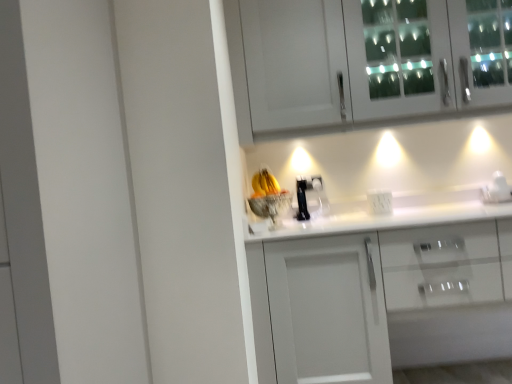
What do you see at coordinates (381, 294) in the screenshot? I see `white glossy cabinet at center, the second cabinetry viewed from the top` at bounding box center [381, 294].

Identify the location of white glossy cabinet at center, the second cabinetry viewed from the top. click(381, 294).

Is white plastic electric outlet at center positioned beyond the bounds of white glossy cabinet at center, the second cabinetry viewed from the top?

Actually, white plastic electric outlet at center is at least partially inside white glossy cabinet at center, the second cabinetry viewed from the top.

This screenshot has width=512, height=384. What are the coordinates of `electric outlet above the white glossy cabinet at center, the second cabinetry viewed from the top (from the image's perspective)` in the screenshot? It's located at (380, 201).

From the image's perspective, which one is positioned higher, white plastic electric outlet at center or white glossy cabinet at center, which is counted as the first cabinetry, starting from the bottom?

white plastic electric outlet at center, from the image's perspective.

Is there a large distance between white glossy coffee maker at right and white glossy cabinet at center, the second cabinetry viewed from the top?

No.

Considering the sizes of white glossy coffee maker at right and white glossy cabinet at center, which is counted as the first cabinetry, starting from the bottom, in the image, is white glossy coffee maker at right wider or thinner than white glossy cabinet at center, which is counted as the first cabinetry, starting from the bottom,?

In the image, white glossy coffee maker at right appears to be more narrow than white glossy cabinet at center, which is counted as the first cabinetry, starting from the bottom.

Starting from the white glossy coffee maker at right, which cabinetry is the 2nd one in front? Please provide its 2D coordinates.

[(381, 294)]

Measure the distance between white glossy coffee maker at right and white plastic electric outlet at center.

A distance of 20.58 inches exists between white glossy coffee maker at right and white plastic electric outlet at center.

In the scene shown: From the image's perspective, between white glossy coffee maker at right and white plastic electric outlet at center, who is located below?

white plastic electric outlet at center, from the image's perspective.

Which object is more forward, white glossy coffee maker at right or white plastic electric outlet at center?

Positioned in front is white glossy coffee maker at right.

The height and width of the screenshot is (384, 512). I want to click on appliance in front of the white plastic electric outlet at center, so click(x=496, y=189).

Locate an element on the screen. This screenshot has height=384, width=512. the 2nd cabinetry to the left of the white glossy coffee maker at right, counting from the anchor's position is located at coordinates (343, 73).

Which is in front, point (502, 185) or point (269, 122)?

The point (269, 122) is in front.

Does white glossy coffee maker at right have a greater height compared to white glass cabinet at upper center, the 1th cabinetry viewed from the top?

In fact, white glossy coffee maker at right may be shorter than white glass cabinet at upper center, the 1th cabinetry viewed from the top.

Can you confirm if white glossy cabinet at center, the second cabinetry viewed from the top, is shorter than white glass cabinet at upper center, the 1th cabinetry viewed from the top?

In fact, white glossy cabinet at center, the second cabinetry viewed from the top, may be taller than white glass cabinet at upper center, the 1th cabinetry viewed from the top.

Which is behind, point (362, 329) or point (305, 29)?

The point (305, 29) is farther.

Which of these two, white glossy cabinet at center, the second cabinetry viewed from the top, or white glass cabinet at upper center, which is the 2th cabinetry from bottom to top, is wider?

Wider between the two is white glossy cabinet at center, the second cabinetry viewed from the top.

Based on the photo, from a real-world perspective, is white glossy cabinet at center, the second cabinetry viewed from the top, physically located above or below white glass cabinet at upper center, which is the 2th cabinetry from bottom to top?

white glossy cabinet at center, the second cabinetry viewed from the top, is situated lower than white glass cabinet at upper center, which is the 2th cabinetry from bottom to top, in the real world.

Does white glossy cabinet at center, the second cabinetry viewed from the top, turn towards white plastic electric outlet at center?

No, white glossy cabinet at center, the second cabinetry viewed from the top, does not turn towards white plastic electric outlet at center.

From the picture: From a real-world perspective, which object rests below the other?

In real-world perspective, white glossy cabinet at center, which is counted as the first cabinetry, starting from the bottom, is lower.

You are a GUI agent. You are given a task and a screenshot of the screen. Output one action in this format:
    pyautogui.click(x=<x>, y=<y>)
    Task: Click on the cabinetry below the white plastic electric outlet at center (from the image's perspective)
    
    Given the screenshot: What is the action you would take?
    pyautogui.click(x=381, y=294)

Is white glossy cabinet at center, which is counted as the first cabinetry, starting from the bottom, at the right side of white plastic electric outlet at center?

Correct, you'll find white glossy cabinet at center, which is counted as the first cabinetry, starting from the bottom, to the right of white plastic electric outlet at center.

Is white glass cabinet at upper center, which is the 2th cabinetry from bottom to top, far from white plastic electric outlet at center?

white glass cabinet at upper center, which is the 2th cabinetry from bottom to top, is near white plastic electric outlet at center, not far away.

You are a GUI agent. You are given a task and a screenshot of the screen. Output one action in this format:
    pyautogui.click(x=<x>, y=<y>)
    Task: Click on the electric outlet behind the white glass cabinet at upper center, which is the 2th cabinetry from bottom to top
    The height and width of the screenshot is (384, 512).
    Given the screenshot: What is the action you would take?
    pyautogui.click(x=380, y=201)

Considering their positions, is white glass cabinet at upper center, which is the 2th cabinetry from bottom to top, located in front of or behind white plastic electric outlet at center?

Clearly, white glass cabinet at upper center, which is the 2th cabinetry from bottom to top, is in front of white plastic electric outlet at center.

Where is `electric outlet behind the white glossy cabinet at center, which is counted as the first cabinetry, starting from the bottom`? The width and height of the screenshot is (512, 384). electric outlet behind the white glossy cabinet at center, which is counted as the first cabinetry, starting from the bottom is located at coordinates (380, 201).

Identify the location of the 2nd cabinetry in front of the white glossy coffee maker at right, starting your count from the anchor. point(381,294).

Based on their spatial positions, is white glossy coffee maker at right or white plastic electric outlet at center further from white glossy cabinet at center, which is counted as the first cabinetry, starting from the bottom?

Based on the image, white glossy coffee maker at right appears to be further to white glossy cabinet at center, which is counted as the first cabinetry, starting from the bottom.

Based on their spatial positions, is white glass cabinet at upper center, which is the 2th cabinetry from bottom to top, or white glossy coffee maker at right further from white glossy cabinet at center, which is counted as the first cabinetry, starting from the bottom?

Among the two, white glossy coffee maker at right is located further to white glossy cabinet at center, which is counted as the first cabinetry, starting from the bottom.

Considering their positions, is white glass cabinet at upper center, the 1th cabinetry viewed from the top, positioned closer to white glossy cabinet at center, the second cabinetry viewed from the top, than white plastic electric outlet at center?

Based on the image, white plastic electric outlet at center appears to be nearer to white glossy cabinet at center, the second cabinetry viewed from the top.

Considering their positions, is white plastic electric outlet at center positioned further to white glass cabinet at upper center, the 1th cabinetry viewed from the top, than white glossy cabinet at center, the second cabinetry viewed from the top?

Among the two, white glossy cabinet at center, the second cabinetry viewed from the top, is located further to white glass cabinet at upper center, the 1th cabinetry viewed from the top.

Looking at the image, which one is located further to white plastic electric outlet at center, white glossy coffee maker at right or white glossy cabinet at center, which is counted as the first cabinetry, starting from the bottom?

white glossy cabinet at center, which is counted as the first cabinetry, starting from the bottom, lies further to white plastic electric outlet at center than the other object.

Based on the photo, looking at the image, which one is located closer to white glossy cabinet at center, the second cabinetry viewed from the top, white glossy coffee maker at right or white glass cabinet at upper center, the 1th cabinetry viewed from the top?

white glass cabinet at upper center, the 1th cabinetry viewed from the top, is closer to white glossy cabinet at center, the second cabinetry viewed from the top.

From the image, which object appears to be nearer to white glossy coffee maker at right, white plastic electric outlet at center or white glass cabinet at upper center, which is the 2th cabinetry from bottom to top?

The object closer to white glossy coffee maker at right is white plastic electric outlet at center.

Which object lies nearer to the anchor point white glossy coffee maker at right, white glass cabinet at upper center, which is the 2th cabinetry from bottom to top, or white plastic electric outlet at center?

white plastic electric outlet at center.

The image size is (512, 384). I want to click on appliance between white glass cabinet at upper center, the 1th cabinetry viewed from the top, and white glossy cabinet at center, which is counted as the first cabinetry, starting from the bottom, vertically, so click(496, 189).

You are a GUI agent. You are given a task and a screenshot of the screen. Output one action in this format:
    pyautogui.click(x=<x>, y=<y>)
    Task: Click on the cabinetry between white plastic electric outlet at center and white glossy coffee maker at right
    
    Given the screenshot: What is the action you would take?
    pyautogui.click(x=381, y=294)

Find the location of a particular element. The height and width of the screenshot is (384, 512). electric outlet between white glass cabinet at upper center, the 1th cabinetry viewed from the top, and white glossy cabinet at center, the second cabinetry viewed from the top, vertically is located at coordinates (380, 201).

In order to click on appliance between white glass cabinet at upper center, which is the 2th cabinetry from bottom to top, and white plastic electric outlet at center, in the vertical direction in this screenshot , I will do `click(496, 189)`.